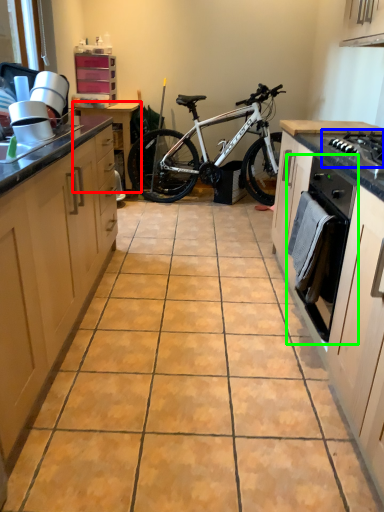
Question: Which object is the farthest from table (highlighted by a red box)? Choose among these: gas stove (highlighted by a blue box) or oven (highlighted by a green box).

Choices:
 (A) gas stove
 (B) oven

Answer: (A)